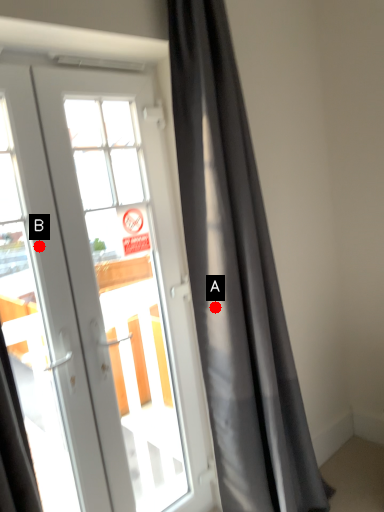
Question: Two points are circled on the image, labeled by A and B beside each circle. Which of the following is the closest to the observer?

Choices:
 (A) A is closer
 (B) B is closer

Answer: (B)